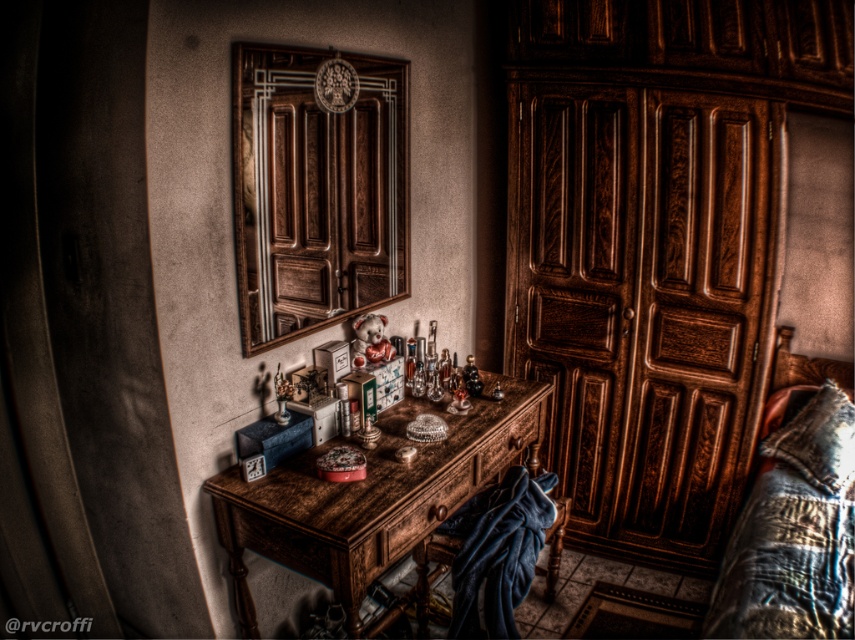
Question: Does wooden armoire at center have a larger size compared to rustic wood table at center?

Choices:
 (A) yes
 (B) no

Answer: (B)

Question: Can you confirm if wooden dresser at center is positioned above wooden armoire at center?

Choices:
 (A) no
 (B) yes

Answer: (A)

Question: Observing the image, what is the correct spatial positioning of wooden armoire at center in reference to rustic wood table at center?

Choices:
 (A) below
 (B) above

Answer: (B)

Question: Which object is positioned closest to the rustic wood table at center?

Choices:
 (A) wooden armoire at center
 (B) wooden dresser at center

Answer: (A)

Question: Estimate the real-world distances between objects in this image. Which object is closer to the wooden armoire at center?

Choices:
 (A) wooden dresser at center
 (B) rustic wood table at center

Answer: (B)

Question: Which of the following is the farthest from the observer?

Choices:
 (A) wooden dresser at center
 (B) wooden armoire at center

Answer: (A)